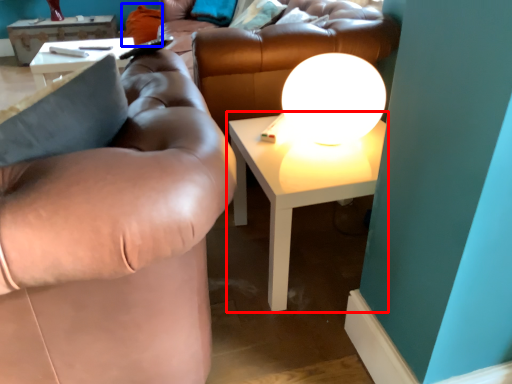
Question: Which object appears farthest to the camera in this image, table (highlighted by a red box) or pillow (highlighted by a blue box)?

Choices:
 (A) table
 (B) pillow

Answer: (B)